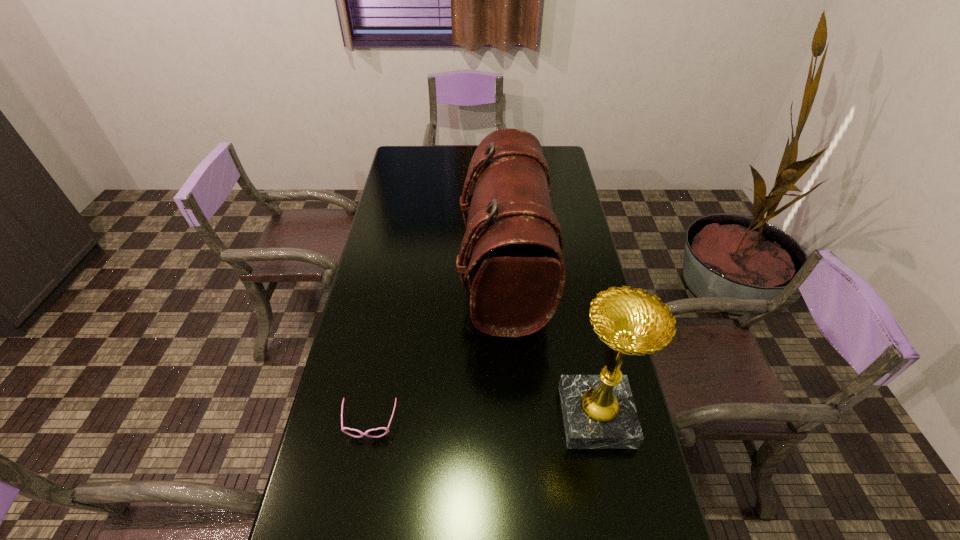
At what (x,y) coordinates should I click in order to perform the action: click on vacant space situated 0.150m on the front-facing side of the shortest object. Please return your answer as a coordinate pair (x, y). The height and width of the screenshot is (540, 960). Looking at the image, I should click on (x=354, y=506).

Where is `object that is at the left edge`? Image resolution: width=960 pixels, height=540 pixels. object that is at the left edge is located at coordinates (379, 432).

Where is `satchel at the right edge`? satchel at the right edge is located at coordinates (518, 277).

Find the location of a particular element. award located in the right edge section of the desktop is located at coordinates (599, 412).

Find the location of a particular element. The width and height of the screenshot is (960, 540). vacant space at the far edge is located at coordinates (469, 164).

Locate an element on the screen. The image size is (960, 540). vacant space at the left edge is located at coordinates [x=419, y=203].

In the image, there is a desktop. Find the location of `vacant space at the right edge`. vacant space at the right edge is located at coordinates (616, 450).

What are the coordinates of `free spot between the leftmost object and the award` in the screenshot? It's located at (483, 420).

The width and height of the screenshot is (960, 540). Find the location of `free spot between the award and the leftmost object`. free spot between the award and the leftmost object is located at coordinates (483, 420).

Where is `free space between the farthest object and the award`? Image resolution: width=960 pixels, height=540 pixels. free space between the farthest object and the award is located at coordinates pyautogui.click(x=550, y=344).